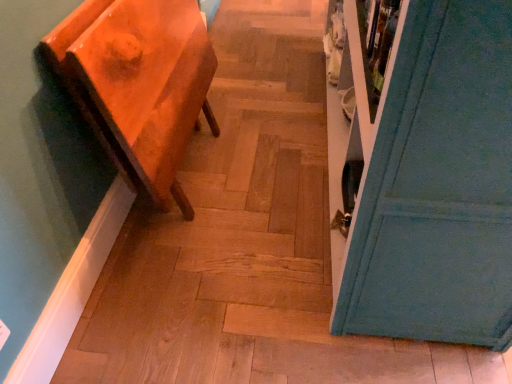
Question: Does point (471, 226) appear closer or farther from the camera than point (128, 74)?

Choices:
 (A) farther
 (B) closer

Answer: (B)

Question: Is teal painted door at right taller or shorter than matte orange side table at left?

Choices:
 (A) short
 (B) tall

Answer: (B)

Question: From the image's perspective, relative to matte orange side table at left, is teal painted door at right above or below?

Choices:
 (A) above
 (B) below

Answer: (A)

Question: Considering the positions of matte orange side table at left and teal painted door at right in the image, is matte orange side table at left bigger or smaller than teal painted door at right?

Choices:
 (A) big
 (B) small

Answer: (B)

Question: From their relative heights in the image, would you say matte orange side table at left is taller or shorter than teal painted door at right?

Choices:
 (A) short
 (B) tall

Answer: (A)

Question: From a real-world perspective, is matte orange side table at left above or below teal painted door at right?

Choices:
 (A) above
 (B) below

Answer: (B)

Question: Is matte orange side table at left in front of or behind teal painted door at right in the image?

Choices:
 (A) front
 (B) behind

Answer: (B)